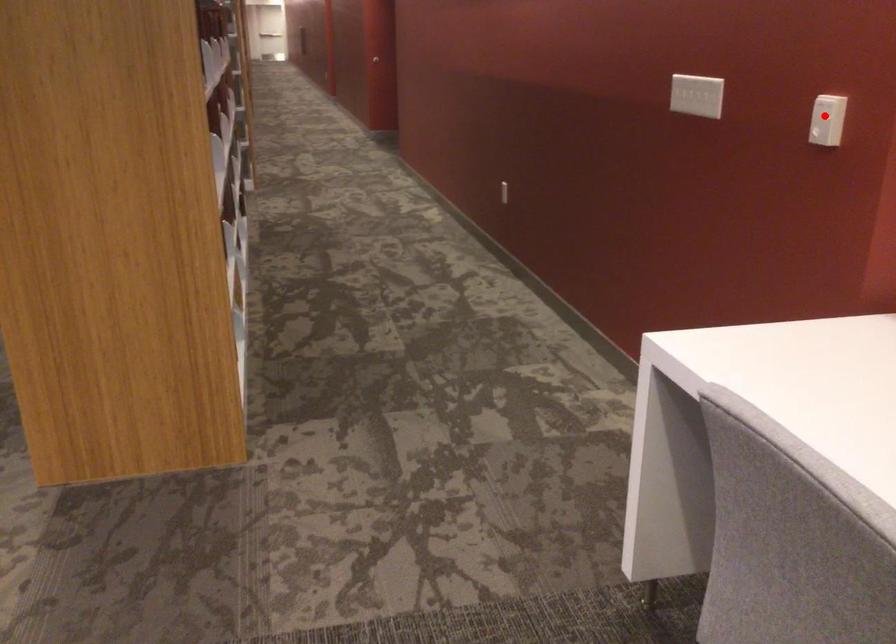
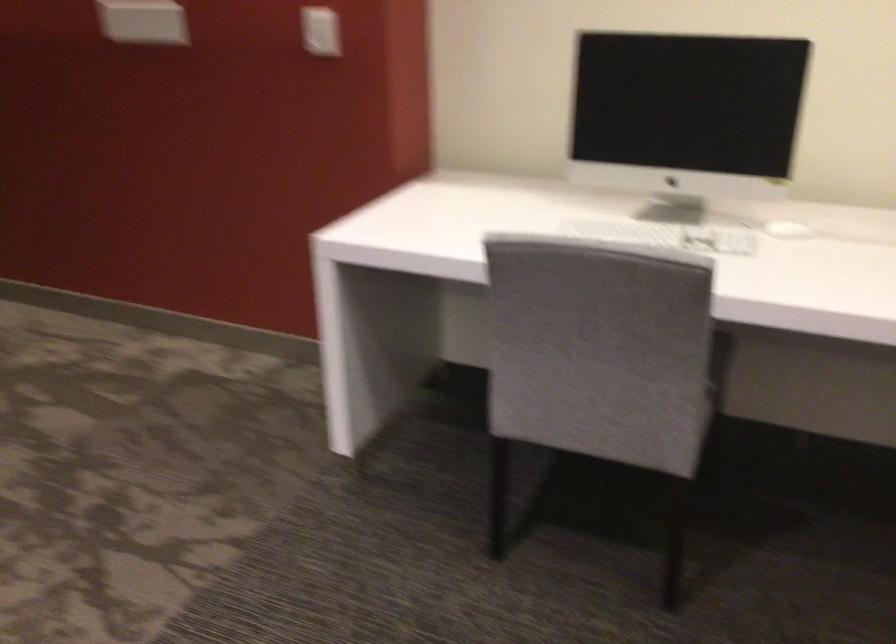
Find the pixel in the second image that matches the highlighted location in the first image.

(321, 31)